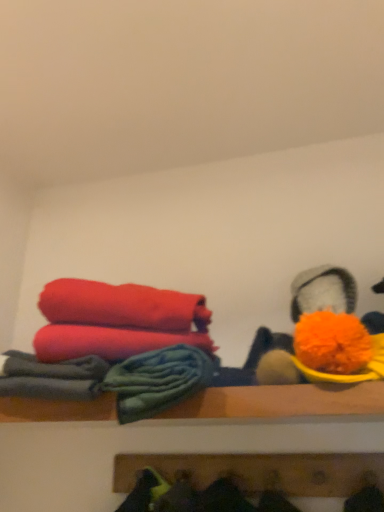
Question: Is wooden coat rack at lower center, which is counted as the 2th shelf, starting from the top, bigger than soft cotton towels at left?

Choices:
 (A) no
 (B) yes

Answer: (B)

Question: Is wooden coat rack at lower center, which is counted as the 2th shelf, starting from the top, not near soft cotton towels at left?

Choices:
 (A) yes
 (B) no

Answer: (B)

Question: Does wooden coat rack at lower center, which is counted as the 2th shelf, starting from the top, turn towards soft cotton towels at left?

Choices:
 (A) yes
 (B) no

Answer: (B)

Question: Are wooden coat rack at lower center, placed as the 1th shelf when sorted from bottom to top, and soft cotton towels at left making contact?

Choices:
 (A) no
 (B) yes

Answer: (A)

Question: Can you confirm if wooden coat rack at lower center, which is counted as the 2th shelf, starting from the top, is thinner than soft cotton towels at left?

Choices:
 (A) yes
 (B) no

Answer: (B)

Question: From a real-world perspective, is matte red towel at left positioned above or below wooden shelf at center, the 1th shelf when ordered from top to bottom?

Choices:
 (A) below
 (B) above

Answer: (B)

Question: Is matte red towel at left taller or shorter than wooden shelf at center, the 1th shelf when ordered from top to bottom?

Choices:
 (A) short
 (B) tall

Answer: (B)

Question: In the image, is matte red towel at left on the left side or the right side of wooden shelf at center, the 1th shelf when ordered from top to bottom?

Choices:
 (A) right
 (B) left

Answer: (B)

Question: In terms of width, does matte red towel at left look wider or thinner when compared to wooden shelf at center, the 1th shelf when ordered from top to bottom?

Choices:
 (A) thin
 (B) wide

Answer: (A)

Question: Considering their positions, is fluffy orange pom-pom at upper right located in front of or behind wooden shelf at center, placed as the 2th shelf when sorted from bottom to top?

Choices:
 (A) behind
 (B) front

Answer: (B)

Question: Considering the positions of fluffy orange pom-pom at upper right and wooden shelf at center, the 1th shelf when ordered from top to bottom, in the image, is fluffy orange pom-pom at upper right bigger or smaller than wooden shelf at center, the 1th shelf when ordered from top to bottom,?

Choices:
 (A) small
 (B) big

Answer: (B)

Question: Is point (352, 287) positioned closer to the camera than point (160, 417)?

Choices:
 (A) closer
 (B) farther

Answer: (B)

Question: From the image's perspective, is fluffy orange pom-pom at upper right positioned above or below wooden shelf at center, placed as the 2th shelf when sorted from bottom to top?

Choices:
 (A) below
 (B) above

Answer: (B)

Question: Is wooden coat rack at lower center, which is counted as the 2th shelf, starting from the top, taller or shorter than wooden shelf at center, placed as the 2th shelf when sorted from bottom to top?

Choices:
 (A) tall
 (B) short

Answer: (A)

Question: Considering the positions of wooden coat rack at lower center, which is counted as the 2th shelf, starting from the top, and wooden shelf at center, placed as the 2th shelf when sorted from bottom to top, in the image, is wooden coat rack at lower center, which is counted as the 2th shelf, starting from the top, bigger or smaller than wooden shelf at center, placed as the 2th shelf when sorted from bottom to top,?

Choices:
 (A) big
 (B) small

Answer: (B)